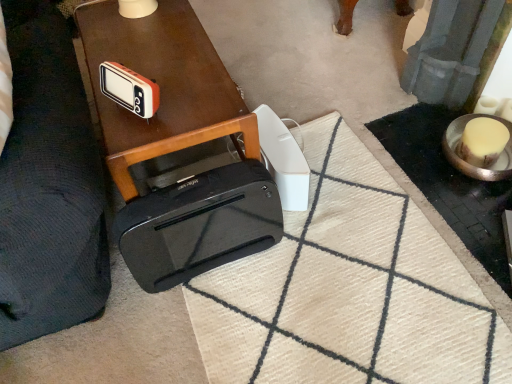
Identify the location of unoccupied region to the right of white plastic remote control at center, positioned as the second gadget in front-to-back order. (340, 178).